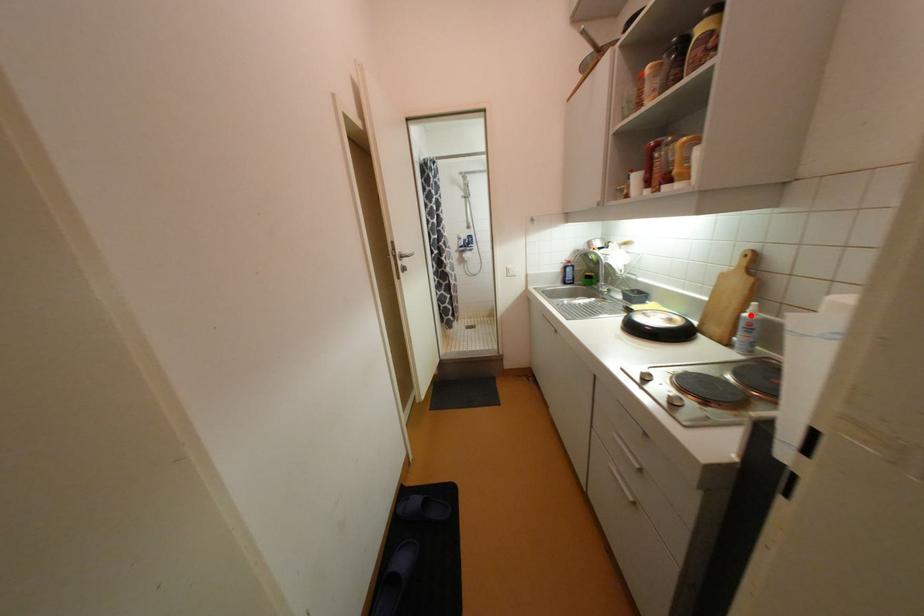
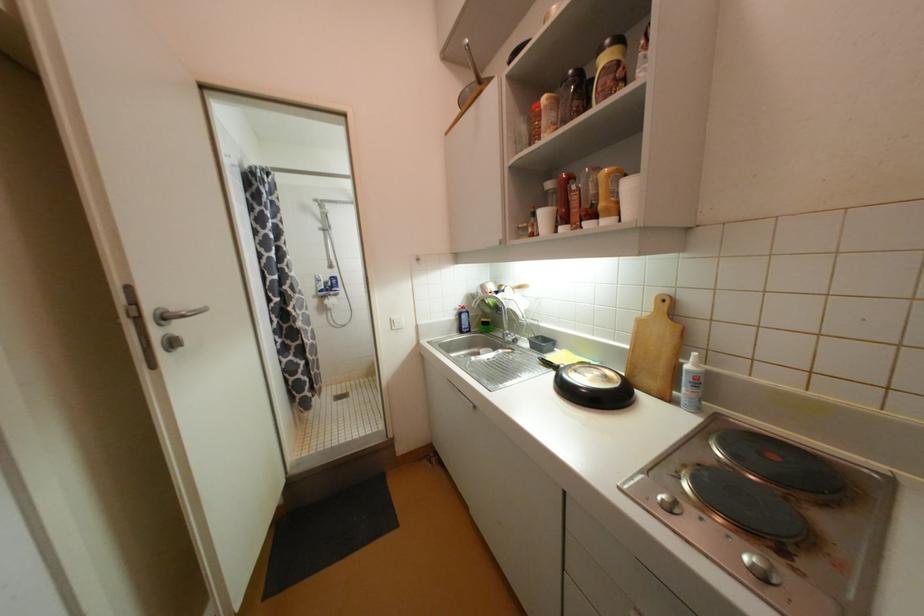
Question: I am providing you with two images of the same scene from different viewpoints. A red point is marked on the first image. Is the red point's position out of view in image 2?

Choices:
 (A) Yes
 (B) No

Answer: (B)